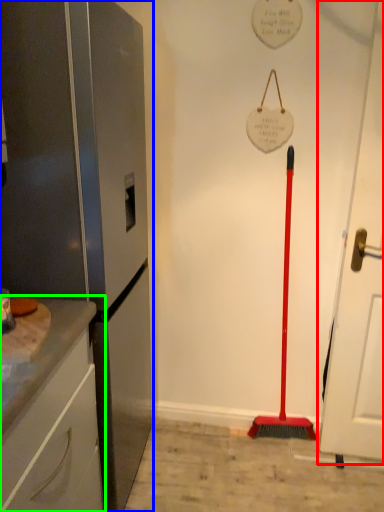
Question: Which is nearer to the door (highlighted by a red box)? appliance (highlighted by a blue box) or cabinetry (highlighted by a green box).

Choices:
 (A) appliance
 (B) cabinetry

Answer: (A)